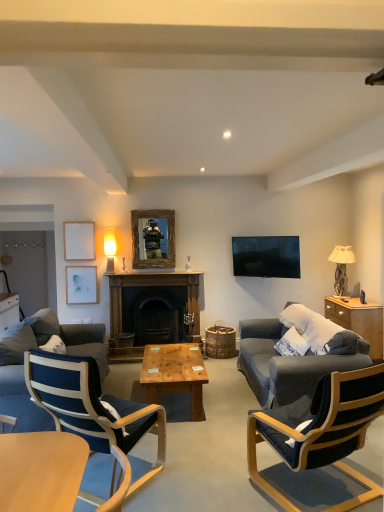
Question: From a real-world perspective, is wooden cabinet at right, the second cabinetry viewed from the left, positioned above or below dark blue fabric chair at right, which is the first chair in right-to-left order?

Choices:
 (A) below
 (B) above

Answer: (B)

Question: Considering the positions of point (380, 323) and point (340, 433), is point (380, 323) closer or farther from the camera than point (340, 433)?

Choices:
 (A) farther
 (B) closer

Answer: (A)

Question: Estimate the real-world distances between objects in this image. Which object is closer to the white glossy cabinet at left, which is the second cabinetry in front-to-back order?

Choices:
 (A) wooden cabinet at right, the second cabinetry viewed from the left
 (B) beige fabric lampshade at right, acting as the first lamp starting from the right
 (C) blue fabric chair at lower left, which is counted as the 2th chair, starting from the right
 (D) light brown wooden coffee table at lower left, placed as the first coffee table when sorted from front to back
 (E) wooden frame mirror at center

Answer: (C)

Question: Estimate the real-world distances between objects in this image. Which object is farther from the matte gold lampshade at upper left, which is counted as the second lamp, starting from the right?

Choices:
 (A) wooden picture frame at upper left, arranged as the first picture frame when viewed from the top
 (B) dark gray fabric couch at left
 (C) wooden frame mirror at center
 (D) light brown wooden coffee table at center, arranged as the second coffee table when viewed from the front
 (E) dark blue fabric chair at right, the 2th chair positioned from the left

Answer: (E)